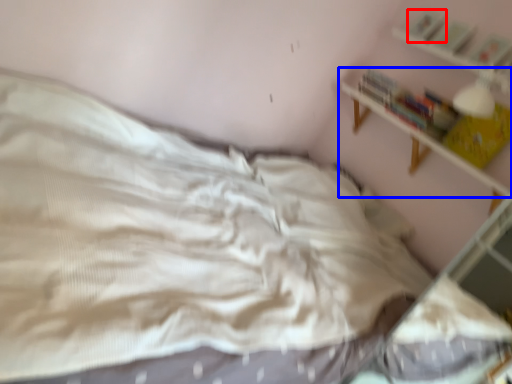
Question: Which object appears closest to the camera in this image, book (highlighted by a red box) or shelf (highlighted by a blue box)?

Choices:
 (A) book
 (B) shelf

Answer: (B)